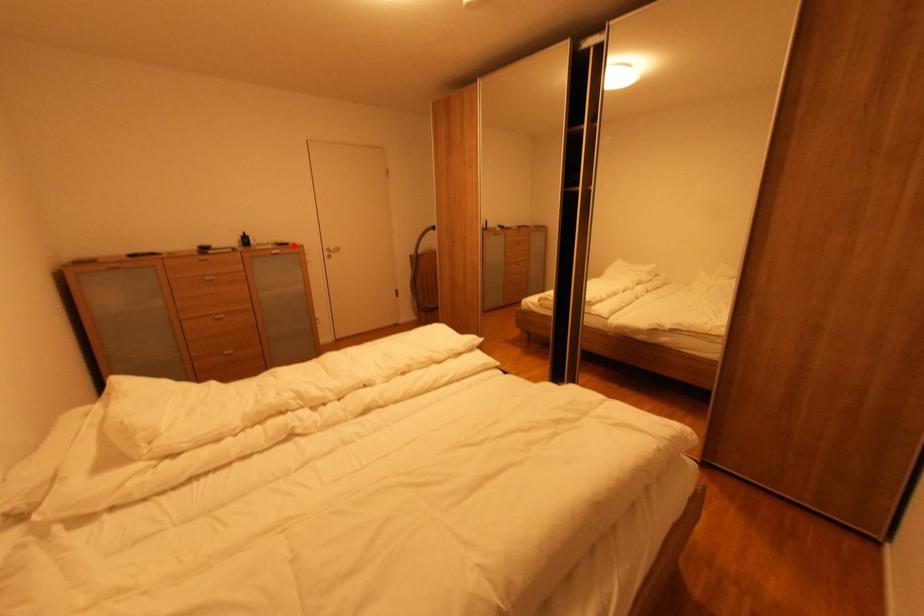
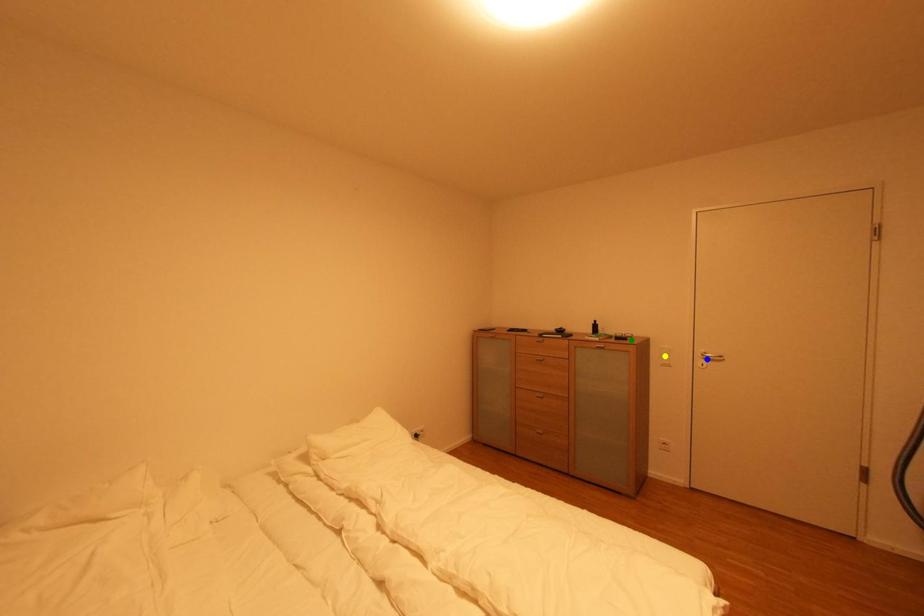
Question: I am providing you with two images of the same scene from different viewpoints. A red point is marked on the first image. You are given multiple points on the second image. Which point in image 2 represents the same 3d spot as the red point in image 1?

Choices:
 (A) yellow point
 (B) blue point
 (C) green point

Answer: (C)